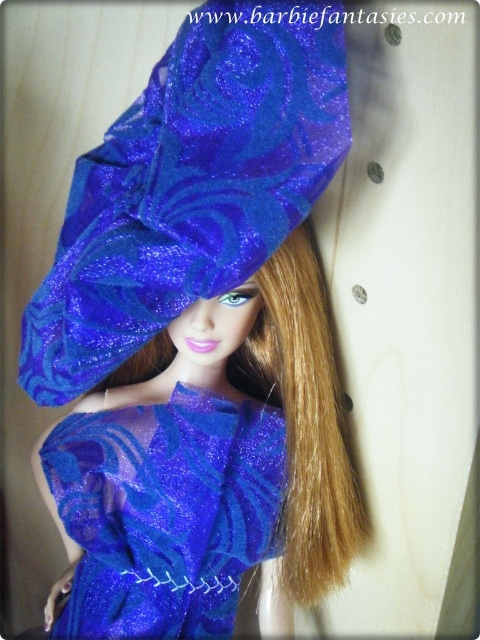
Question: Does shiny blue fabric hat at upper center have a smaller size compared to shiny blue fabric dress at center?

Choices:
 (A) yes
 (B) no

Answer: (B)

Question: Which object appears closest to the camera in this image?

Choices:
 (A) shiny blue fabric dress at center
 (B) shiny blue fabric hat at upper center

Answer: (B)

Question: Which point appears farthest from the camera in this image?

Choices:
 (A) (235, 144)
 (B) (207, 611)

Answer: (B)

Question: Is shiny blue fabric hat at upper center below shiny blue fabric dress at center?

Choices:
 (A) yes
 (B) no

Answer: (B)

Question: Can you confirm if shiny blue fabric hat at upper center is positioned above shiny blue fabric dress at center?

Choices:
 (A) no
 (B) yes

Answer: (B)